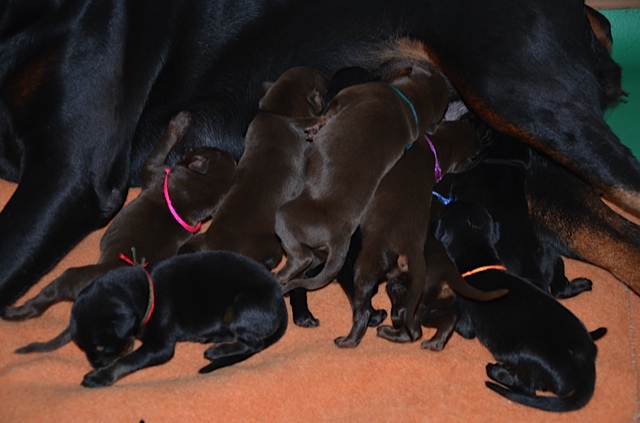
Where is `chest`? The image size is (640, 423). chest is located at coordinates pyautogui.click(x=20, y=158).